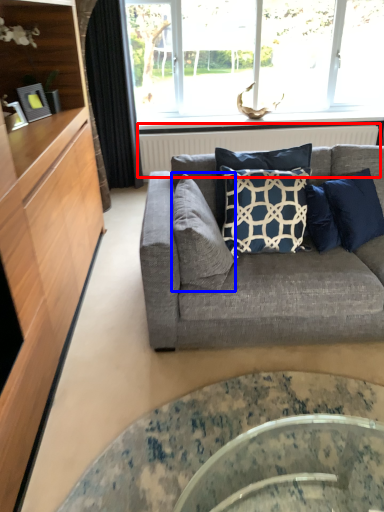
Question: Which point is closer to the camera, radiator (highlighted by a red box) or pillow (highlighted by a blue box)?

Choices:
 (A) radiator
 (B) pillow

Answer: (B)